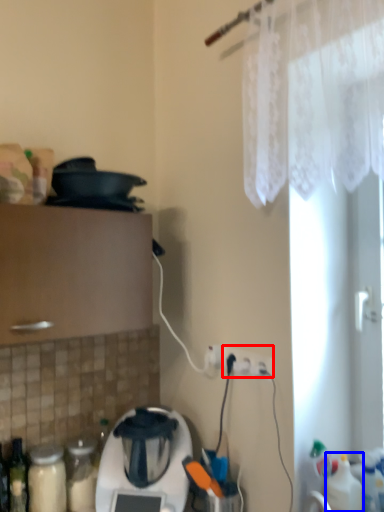
Question: Which object appears closest to the camera in this image, electric outlet (highlighted by a red box) or bottle (highlighted by a blue box)?

Choices:
 (A) electric outlet
 (B) bottle

Answer: (B)